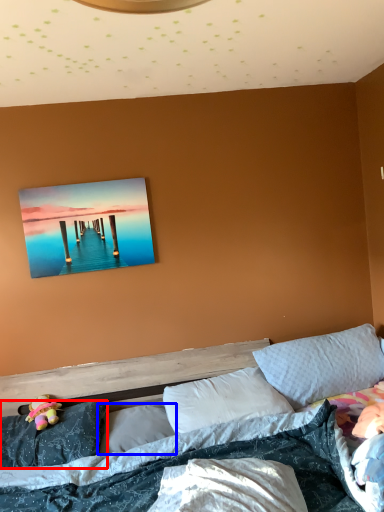
Question: Which of the following is the farthest to the observer, pillow (highlighted by a red box) or pillow (highlighted by a blue box)?

Choices:
 (A) pillow
 (B) pillow

Answer: (B)